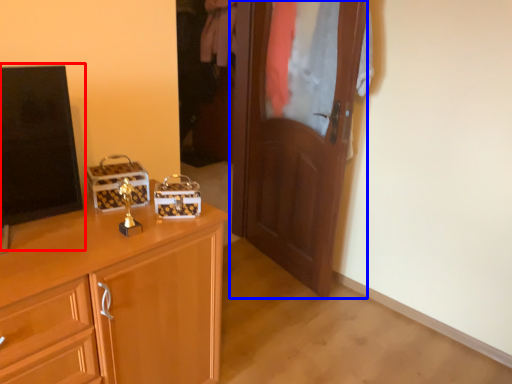
Question: Which of the following is the farthest to the observer, tv show (highlighted by a red box) or door (highlighted by a blue box)?

Choices:
 (A) tv show
 (B) door

Answer: (B)